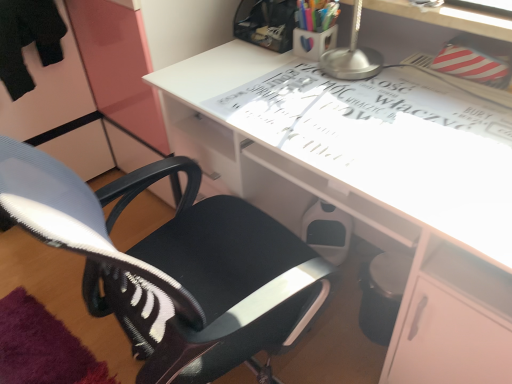
Question: Is translucent plastic cup at upper center, acting as the 1th stationery starting from the top, surrounded by matte plastic cup at upper center, which appears as the 2th stationery when viewed from the top?

Choices:
 (A) no
 (B) yes

Answer: (A)

Question: Can you confirm if matte plastic cup at upper center, the first stationery in the bottom-to-top sequence, is thinner than translucent plastic cup at upper center, acting as the 1th stationery starting from the top?

Choices:
 (A) yes
 (B) no

Answer: (B)

Question: Considering the relative sizes of matte plastic cup at upper center, the first stationery in the bottom-to-top sequence, and translucent plastic cup at upper center, marked as the 2th stationery in a bottom-to-top arrangement, in the image provided, is matte plastic cup at upper center, the first stationery in the bottom-to-top sequence, bigger than translucent plastic cup at upper center, marked as the 2th stationery in a bottom-to-top arrangement,?

Choices:
 (A) no
 (B) yes

Answer: (A)

Question: Considering the relative positions of matte plastic cup at upper center, which appears as the 2th stationery when viewed from the top, and translucent plastic cup at upper center, acting as the 1th stationery starting from the top, in the image provided, is matte plastic cup at upper center, which appears as the 2th stationery when viewed from the top, to the right of translucent plastic cup at upper center, acting as the 1th stationery starting from the top, from the viewer's perspective?

Choices:
 (A) no
 (B) yes

Answer: (B)

Question: Can you confirm if matte plastic cup at upper center, which appears as the 2th stationery when viewed from the top, is taller than translucent plastic cup at upper center, acting as the 1th stationery starting from the top?

Choices:
 (A) yes
 (B) no

Answer: (B)

Question: In terms of height, does black fabric chair at center look taller or shorter compared to translucent plastic cup at upper center, marked as the 2th stationery in a bottom-to-top arrangement?

Choices:
 (A) short
 (B) tall

Answer: (B)

Question: Considering their positions, is black fabric chair at center located in front of or behind translucent plastic cup at upper center, marked as the 2th stationery in a bottom-to-top arrangement?

Choices:
 (A) front
 (B) behind

Answer: (A)

Question: From the image's perspective, is black fabric chair at center located above or below translucent plastic cup at upper center, marked as the 2th stationery in a bottom-to-top arrangement?

Choices:
 (A) below
 (B) above

Answer: (A)

Question: Is black fabric chair at center wider or thinner than translucent plastic cup at upper center, marked as the 2th stationery in a bottom-to-top arrangement?

Choices:
 (A) wide
 (B) thin

Answer: (A)

Question: Is matte plastic cup at upper center, the first stationery in the bottom-to-top sequence, bigger or smaller than translucent plastic cup at upper center, acting as the 1th stationery starting from the top?

Choices:
 (A) small
 (B) big

Answer: (A)

Question: Considering the relative positions of matte plastic cup at upper center, the first stationery in the bottom-to-top sequence, and translucent plastic cup at upper center, acting as the 1th stationery starting from the top, in the image provided, is matte plastic cup at upper center, the first stationery in the bottom-to-top sequence, to the left or to the right of translucent plastic cup at upper center, acting as the 1th stationery starting from the top,?

Choices:
 (A) left
 (B) right

Answer: (B)

Question: Is matte plastic cup at upper center, which appears as the 2th stationery when viewed from the top, taller or shorter than translucent plastic cup at upper center, marked as the 2th stationery in a bottom-to-top arrangement?

Choices:
 (A) short
 (B) tall

Answer: (A)

Question: Is point (309, 41) positioned closer to the camera than point (310, 8)?

Choices:
 (A) farther
 (B) closer

Answer: (A)

Question: Looking at the image, does matte plastic cup at upper center, which appears as the 2th stationery when viewed from the top, seem bigger or smaller compared to white glossy desk at center?

Choices:
 (A) big
 (B) small

Answer: (B)

Question: Is matte plastic cup at upper center, which appears as the 2th stationery when viewed from the top, inside the boundaries of white glossy desk at center, or outside?

Choices:
 (A) outside
 (B) inside

Answer: (A)